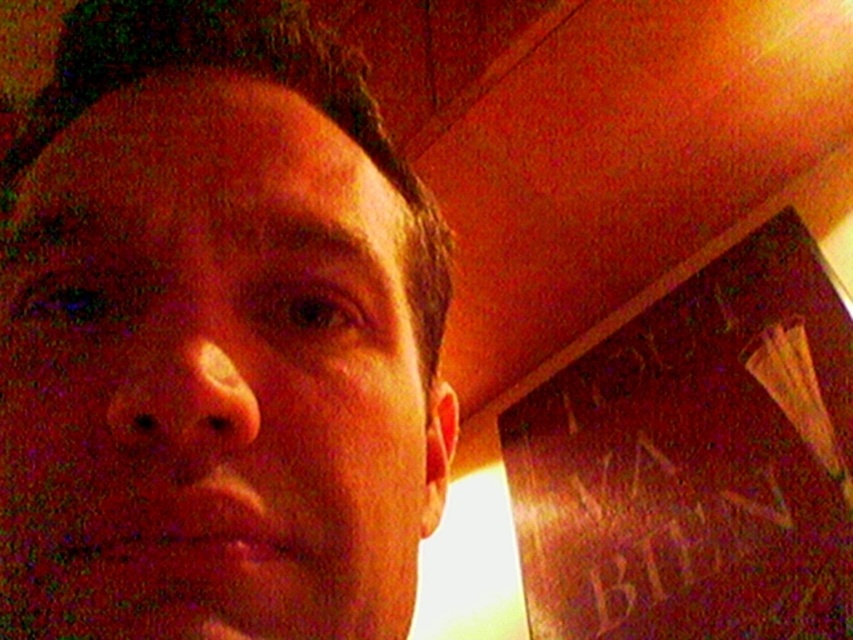
Question: Can you confirm if matte skin at center is thinner than wooden bulletin board at right?

Choices:
 (A) yes
 (B) no

Answer: (A)

Question: Does matte skin at center appear under wooden bulletin board at right?

Choices:
 (A) no
 (B) yes

Answer: (A)

Question: Is matte skin at center bigger than wooden bulletin board at right?

Choices:
 (A) no
 (B) yes

Answer: (A)

Question: Which object is closer to the camera taking this photo?

Choices:
 (A) wooden bulletin board at right
 (B) matte skin at center

Answer: (B)

Question: Which point is closer to the camera?

Choices:
 (A) wooden bulletin board at right
 (B) matte skin at center

Answer: (B)